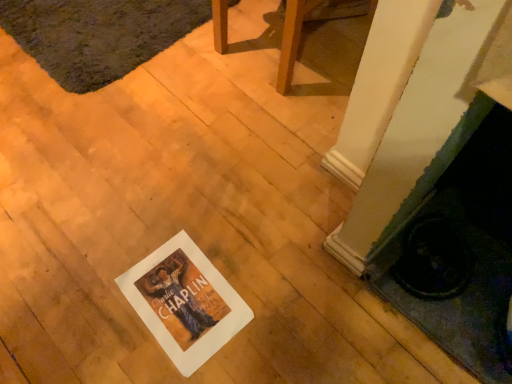
The image size is (512, 384). What are the coordinates of `free space to the left of wooden chair at center` in the screenshot? It's located at (173, 79).